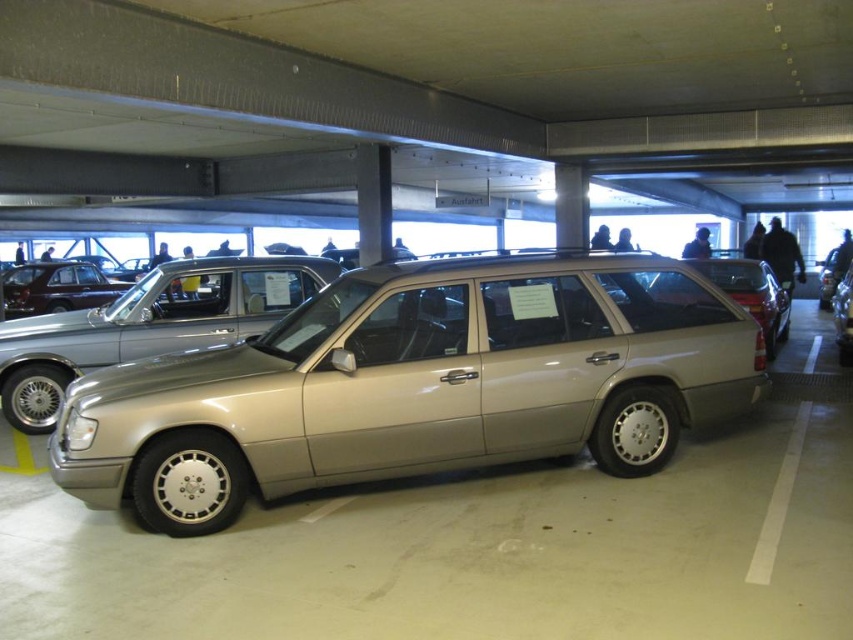
Question: Which point is closer to the camera?

Choices:
 (A) shiny dark brown car at center
 (B) satin gold station wagon at center

Answer: (B)

Question: In this image, where is satin gold station wagon at center located relative to shiny dark brown car at center?

Choices:
 (A) left
 (B) right

Answer: (B)

Question: Which of the following is the farthest from the observer?

Choices:
 (A) shiny dark brown car at center
 (B) satin gold station wagon at center

Answer: (A)

Question: Which point is farther to the camera?

Choices:
 (A) (50, 301)
 (B) (125, 474)

Answer: (A)

Question: Can you confirm if satin gold station wagon at center is bigger than shiny dark brown car at center?

Choices:
 (A) no
 (B) yes

Answer: (B)

Question: In this image, where is satin gold station wagon at center located relative to shiny dark brown car at center?

Choices:
 (A) below
 (B) above

Answer: (A)